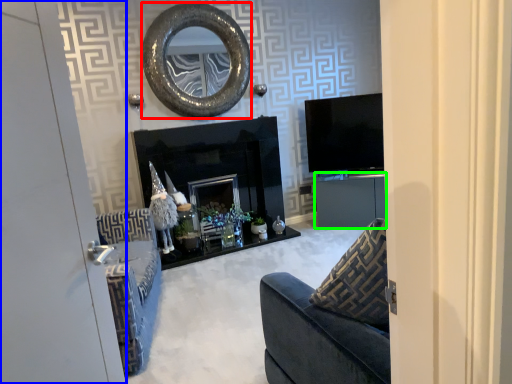
Question: Which object is the closest to the oval (highlighted by a red box)? Choose among these: door (highlighted by a blue box) or cabinetry (highlighted by a green box).

Choices:
 (A) door
 (B) cabinetry

Answer: (B)